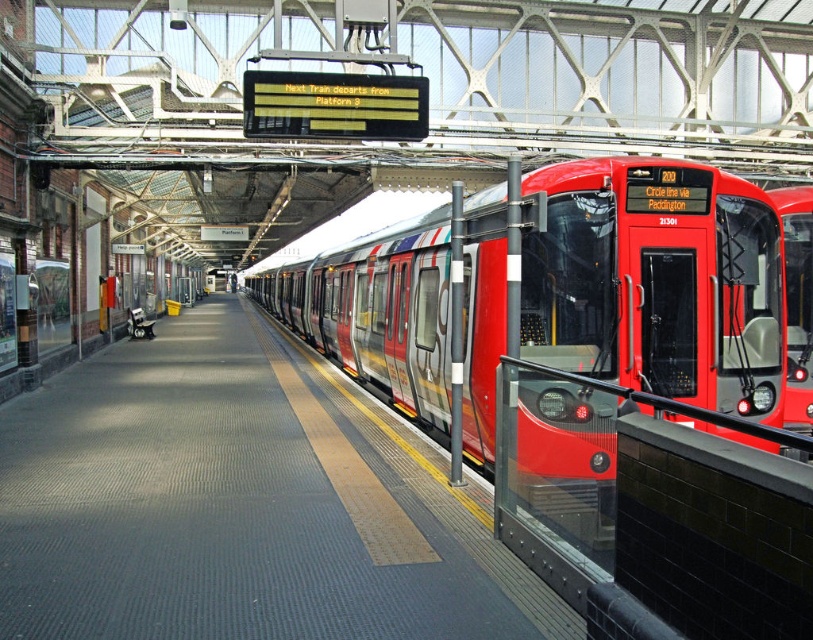
You are standing on the train station platform and want to walk from point (246, 352) to point (372, 269). Which direction should you move in relation to the train?

You should move away from the train because point (372, 269) is further from the viewer compared to point (246, 352), which means moving towards it would require going deeper into the platform area away from the train.

You are a passenger waiting on the smooth concrete platform at center. You see the metallic red train at center above you. Is the train currently stopped on the platform?

Yes, the smooth concrete platform at center is positioned under metallic red train at center, indicating the train is stopped on the platform.

Consider the image. You are a passenger waiting on the smooth concrete platform at center. You see the metallic red train at center approaching. Will the train pass behind the platform where you are standing?

The metallic red train at center is behind the smooth concrete platform at center, so the train will pass behind the platform where you are standing.